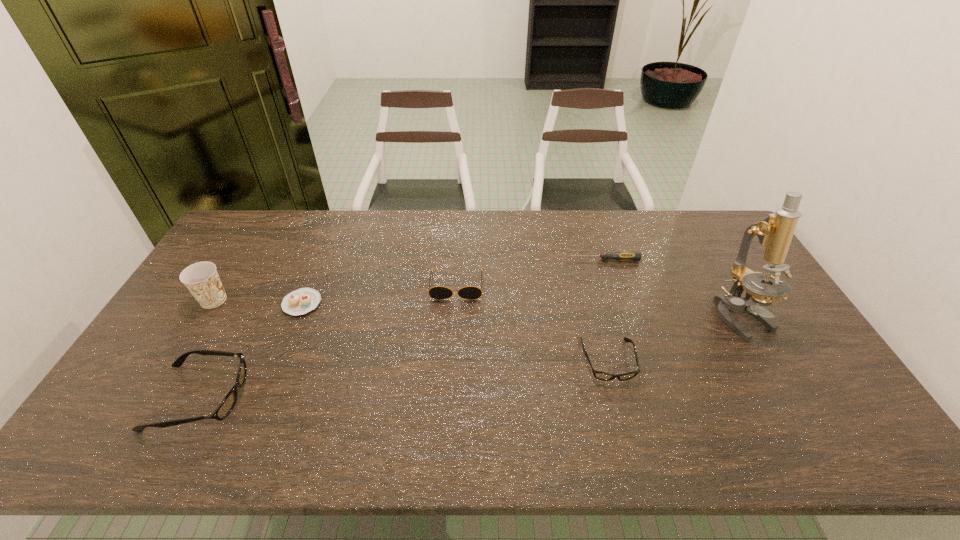
If we want them evenly spaced by inserting an extra spectacles among them, please locate a free spot for this new spectacles. Please provide its 2D coordinates. Your answer should be formatted as a tuple, i.e. [(x, y)], where the tuple contains the x and y coordinates of a point satisfying the conditions above.

[(411, 378)]